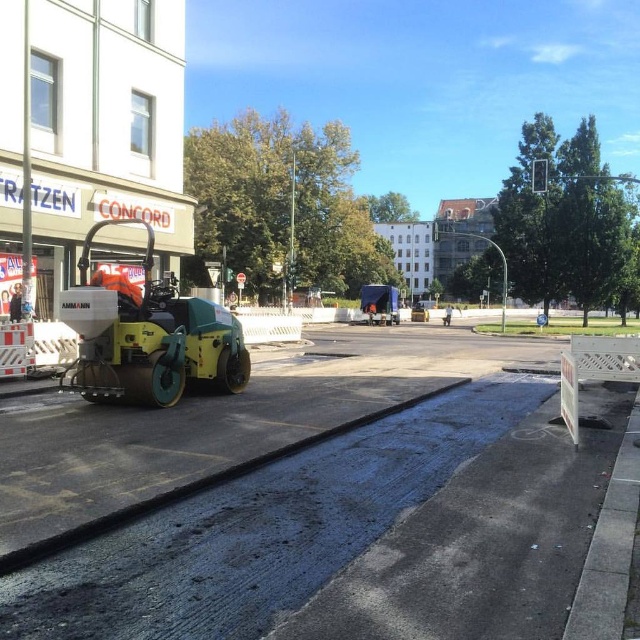
Is green rubber road roller at left above orange reflective vest at center?

Incorrect, green rubber road roller at left is not positioned above orange reflective vest at center.

Does green rubber road roller at left have a lesser height compared to orange reflective vest at center?

Correct, green rubber road roller at left is not as tall as orange reflective vest at center.

This screenshot has height=640, width=640. Describe the element at coordinates (147, 336) in the screenshot. I see `green rubber road roller at left` at that location.

Identify the location of green rubber road roller at left. (147, 336).

Is point (371, 544) positioned in front of point (445, 310)?

Yes.

Image resolution: width=640 pixels, height=640 pixels. I want to click on black asphalt at lower left, so click(316, 499).

Between point (228, 512) and point (445, 321), which one is positioned in front?

Point (228, 512) is in front.

Find the location of `black asphalt at lower left`. black asphalt at lower left is located at coordinates (316, 499).

Does green rubber road roller at left appear under metallic green construction vehicle at center?

Yes, green rubber road roller at left is below metallic green construction vehicle at center.

Is point (83, 320) positioned before point (376, 304)?

Yes, point (83, 320) is in front of point (376, 304).

Is point (179, 337) positioned in front of point (390, 305)?

Yes, point (179, 337) is in front of point (390, 305).

Where is `green rubber road roller at left`? This screenshot has height=640, width=640. green rubber road roller at left is located at coordinates (147, 336).